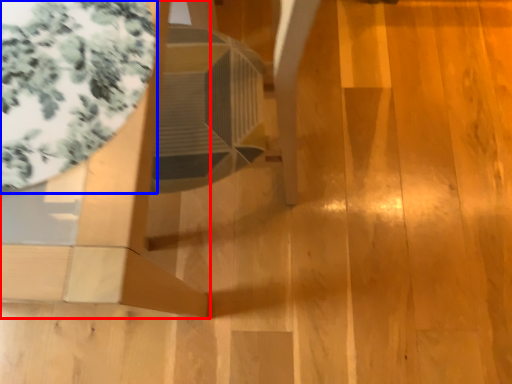
Question: Which object appears closest to the camera in this image, furniture (highlighted by a red box) or glass table (highlighted by a blue box)?

Choices:
 (A) furniture
 (B) glass table

Answer: (A)